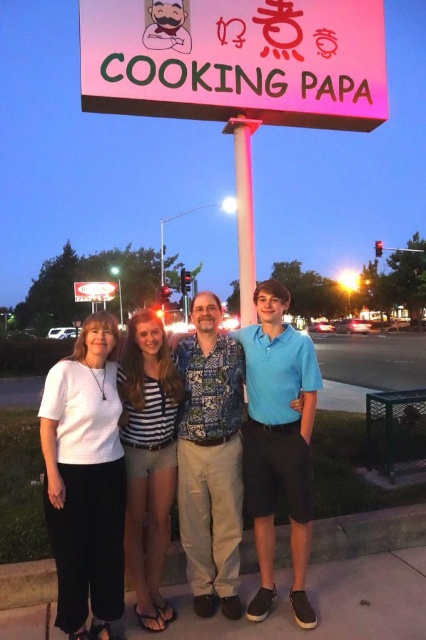
Between point (112, 410) and point (172, 452), which one is positioned in front?

Point (112, 410)

Is white matte shirt at left above striped fabric shorts at center?

Result: No.

Is point (52, 442) closer to viewer compared to point (161, 352)?

Yes, point (52, 442) is closer to viewer.

Identify the location of white matte shirt at left. The image size is (426, 640). (86, 481).

Can you confirm if white cotton shirt at center is shorter than metallic pole at center?

Indeed, white cotton shirt at center has a lesser height compared to metallic pole at center.

Measure the distance from white cotton shirt at center to metallic pole at center.

7.21 feet

Between point (307, 605) and point (253, 228), which one is positioned behind?

Positioned behind is point (253, 228).

I want to click on white cotton shirt at center, so click(245, 449).

Which is behind, point (181, 74) or point (245, 244)?

Positioned behind is point (245, 244).

Is point (132, 19) farther from viewer compared to point (244, 129)?

No, it is in front of (244, 129).

Locate an element on the screen. This screenshot has width=426, height=640. pink neon sign at upper center is located at coordinates (236, 60).